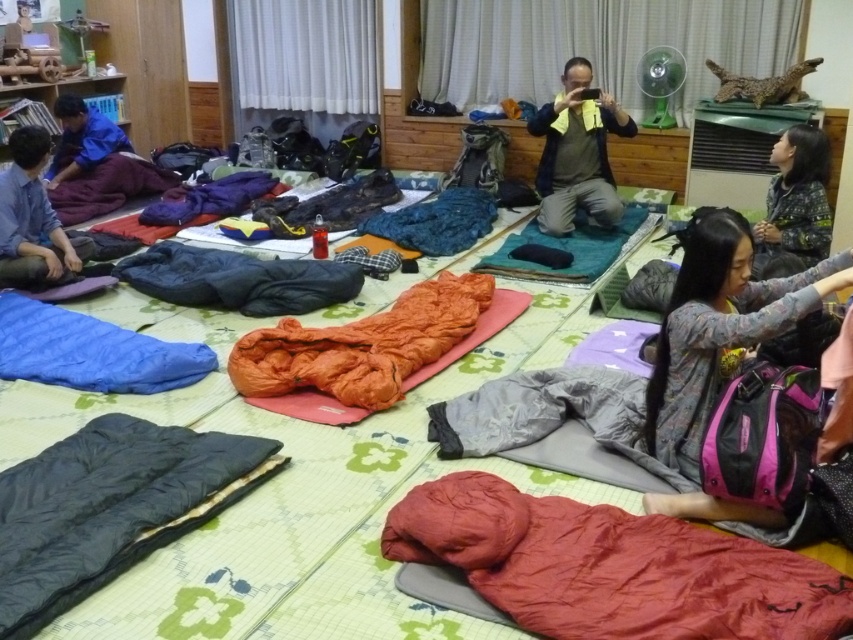
Question: Which object is the farthest from the blue fabric sleeping bag at upper left?

Choices:
 (A) patterned fabric jacket at right
 (B) pink fabric backpack at lower right
 (C) yellow towel at center
 (D) blue denim shirt at left

Answer: (B)

Question: Based on their relative distances, which object is nearer to the blue denim shirt at left?

Choices:
 (A) blue fabric sleeping bag at upper left
 (B) yellow towel at center

Answer: (A)

Question: Which of the following is the farthest from the observer?

Choices:
 (A) blue fabric sleeping bag at upper left
 (B) pink fabric backpack at lower right
 (C) patterned fabric jacket at right
 (D) blue denim shirt at left

Answer: (A)

Question: Does red silky sleeping bag at lower right lie in front of pink fabric backpack at lower right?

Choices:
 (A) no
 (B) yes

Answer: (B)

Question: Does patterned fabric jacket at right appear on the right side of blue fabric sleeping bag at upper left?

Choices:
 (A) yes
 (B) no

Answer: (A)

Question: Is the position of pink fabric backpack at lower right less distant than that of blue denim shirt at left?

Choices:
 (A) yes
 (B) no

Answer: (A)